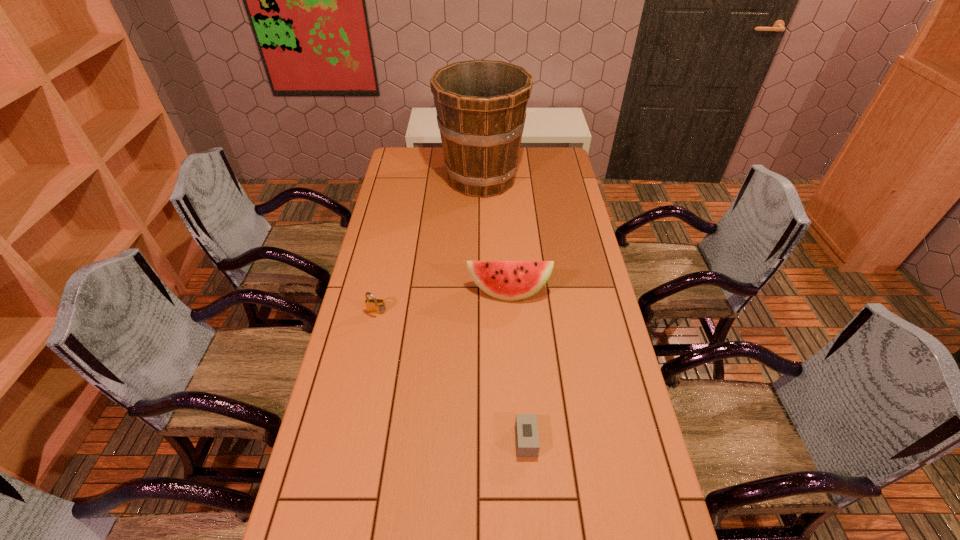
Where is `bucket`? bucket is located at coordinates (481, 105).

The width and height of the screenshot is (960, 540). What are the coordinates of `the farthest object` in the screenshot? It's located at (481, 105).

The height and width of the screenshot is (540, 960). In order to click on the third shortest object in this screenshot , I will do `click(506, 280)`.

Where is `watermelon`? watermelon is located at coordinates (506, 280).

You are a GUI agent. You are given a task and a screenshot of the screen. Output one action in this format:
    pyautogui.click(x=<x>, y=<y>)
    Task: Click on the leftmost object
    The height and width of the screenshot is (540, 960).
    Given the screenshot: What is the action you would take?
    pyautogui.click(x=375, y=306)

Where is `padlock`? This screenshot has height=540, width=960. padlock is located at coordinates (375, 306).

The image size is (960, 540). Identify the location of the shortest object. (526, 426).

This screenshot has width=960, height=540. In order to click on alarm clock in this screenshot , I will do `click(526, 426)`.

Identify the location of free point located 0.070m on the front of the farthest object. The width and height of the screenshot is (960, 540). (482, 215).

Identify the location of blank space located on the outer rind of the second tallest object. The width and height of the screenshot is (960, 540). (516, 408).